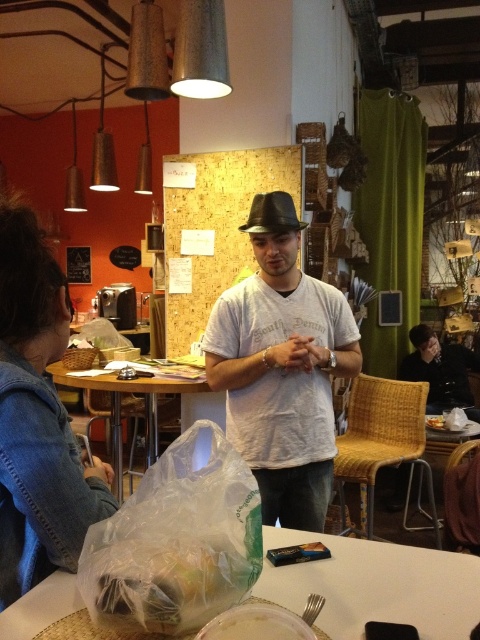
You are a customer at this cafe and want to place your phone between the clear plastic bag at lower center and the white plastic container at lower center on the table. Can you fit your phone there?

The distance between the clear plastic bag at lower center and the white plastic container at lower center is 14.27 inches. Since most phones are significantly smaller than this, your phone should fit comfortably between them.

You are a customer in this cafe and want to place your phone between the white matte shirt at center and the denim jacket at lower left. Can you fit it there?

The distance between the white matte shirt at center and the denim jacket at lower left is 32.02 inches, which is more than enough space to place a phone between them.

You are sitting at the table in the image and want to reach for the white plastic container at lower center without touching the white matte shirt at center. Is this possible based on their positions?

The white matte shirt at center is positioned on the right side of the white plastic container at lower center, so you can reach the white plastic container at lower center without touching the white matte shirt at center by moving your hand from the left side.